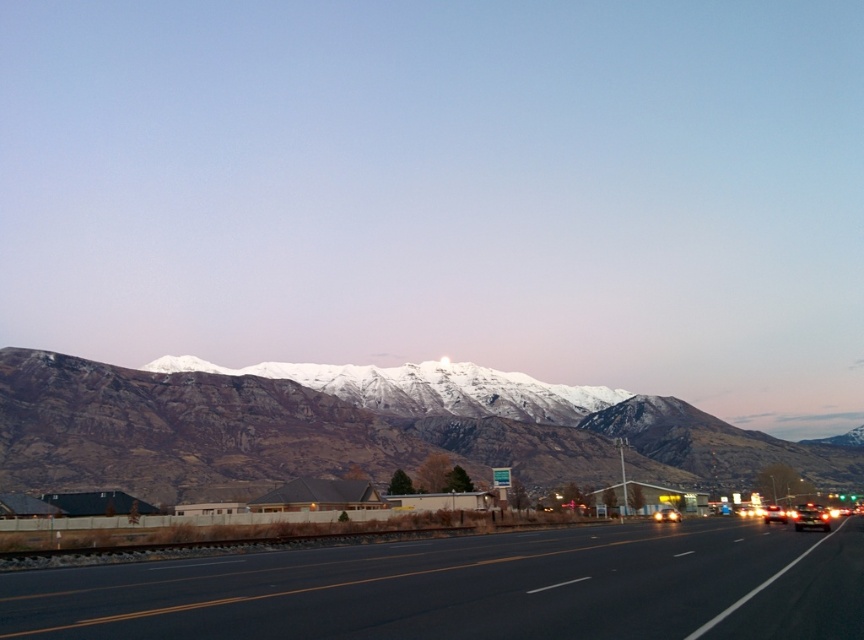
Which is below, rocky brown mountain range at upper center or shiny black sedan at right?

rocky brown mountain range at upper center

What do you see at coordinates (341, 436) in the screenshot?
I see `rocky brown mountain range at upper center` at bounding box center [341, 436].

You are a GUI agent. You are given a task and a screenshot of the screen. Output one action in this format:
    pyautogui.click(x=<x>, y=<y>)
    Task: Click on the rocky brown mountain range at upper center
    The width and height of the screenshot is (864, 640).
    Given the screenshot: What is the action you would take?
    pyautogui.click(x=341, y=436)

Does rocky brown mountain range at upper center lie in front of shiny silver sedan at center?

That is False.

Does rocky brown mountain range at upper center appear on the right side of shiny silver sedan at center?

No, rocky brown mountain range at upper center is not to the right of shiny silver sedan at center.

The height and width of the screenshot is (640, 864). I want to click on rocky brown mountain range at upper center, so click(341, 436).

Locate an element on the screen. The height and width of the screenshot is (640, 864). rocky brown mountain range at upper center is located at coordinates (341, 436).

Consider the image. Can you confirm if shiny black sedan at right is bigger than metallic silver sedan at center-right?

Indeed, shiny black sedan at right has a larger size compared to metallic silver sedan at center-right.

Between point (817, 515) and point (766, 520), which one is positioned in front?

Positioned in front is point (817, 515).

Who is more distant from viewer, (798, 508) or (772, 504)?

The point (798, 508) is behind.

This screenshot has width=864, height=640. I want to click on shiny black sedan at right, so click(x=811, y=516).